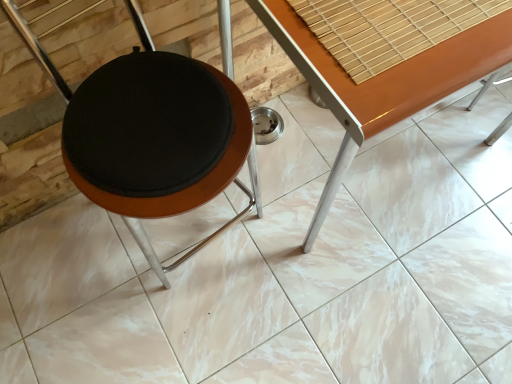
This screenshot has width=512, height=384. I want to click on vacant area in front of wooden glossy table at center, so click(370, 302).